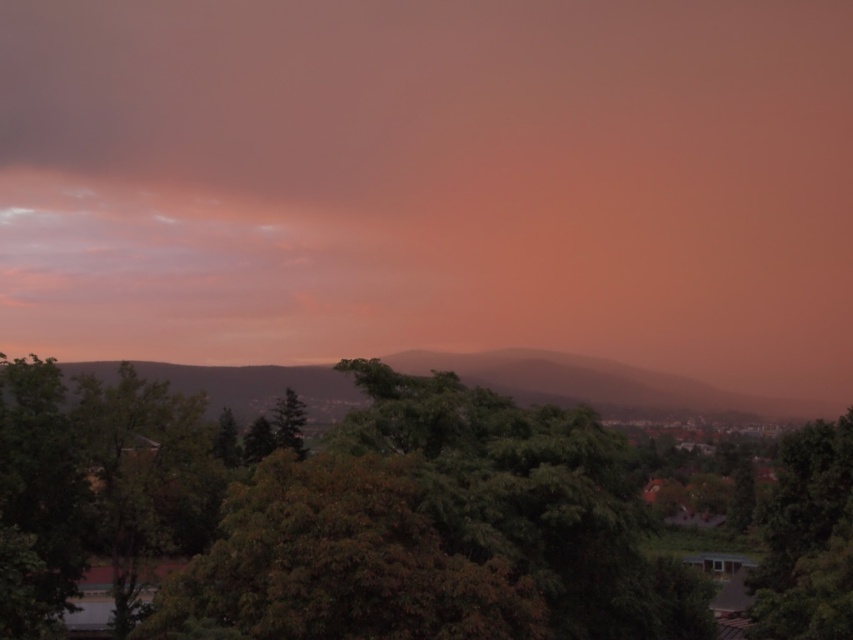
Does pink matte cloud at upper center have a lesser width compared to green leafy trees at center?

In fact, pink matte cloud at upper center might be wider than green leafy trees at center.

Between pink matte cloud at upper center and green leafy trees at center, which one has less height?

green leafy trees at center

Is point (332, 26) farther from camera compared to point (436, 356)?

Yes, it is behind point (436, 356).

Locate an element on the screen. The width and height of the screenshot is (853, 640). pink matte cloud at upper center is located at coordinates (432, 182).

Is point (822, 484) less distant than point (291, 413)?

That is True.

Between green leafy tree at right and green matte tree at center, which one appears on the left side from the viewer's perspective?

From the viewer's perspective, green matte tree at center appears more on the left side.

Locate an element on the screen. This screenshot has height=640, width=853. green leafy tree at right is located at coordinates (807, 538).

In the scene shown: Who is positioned more to the right, green leafy trees at center or green matte tree at center?

From the viewer's perspective, green matte tree at center appears more on the right side.

Is point (759, 416) less distant than point (281, 410)?

No, (759, 416) is behind (281, 410).

Is point (457, 358) closer to viewer compared to point (300, 456)?

No, (457, 358) is behind (300, 456).

The width and height of the screenshot is (853, 640). I want to click on green leafy trees at center, so click(x=607, y=385).